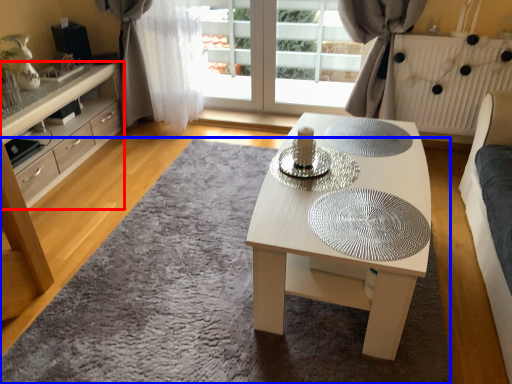
Question: Which point is closer to the camera, cabinetry (highlighted by a red box) or mat (highlighted by a blue box)?

Choices:
 (A) cabinetry
 (B) mat

Answer: (B)